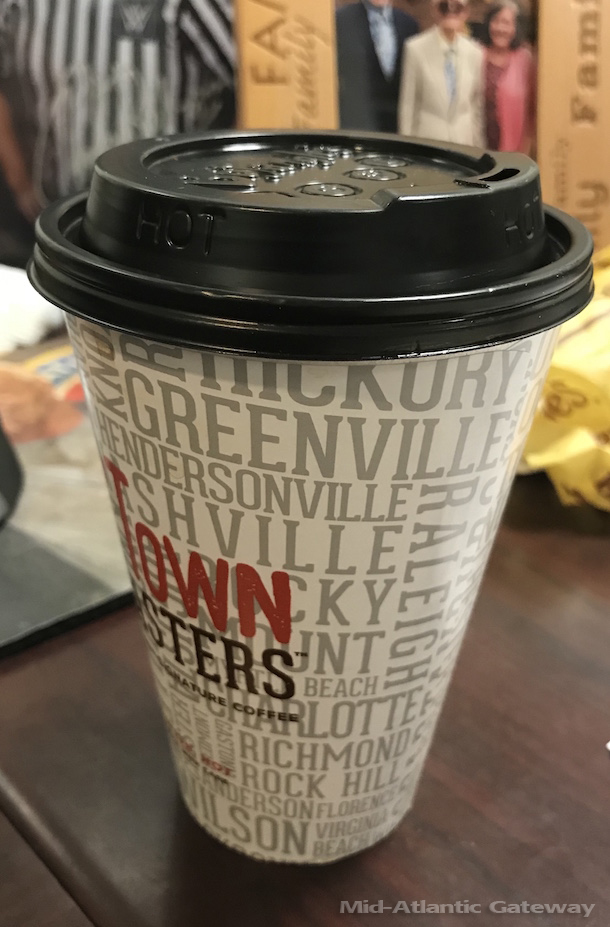
Find the location of a particular element. light brown photo frame is located at coordinates (279, 96).